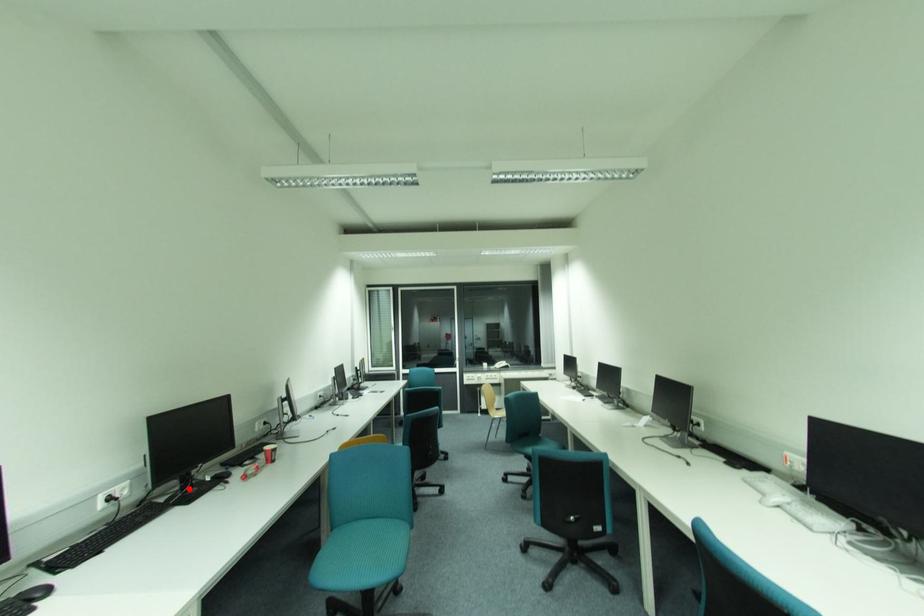
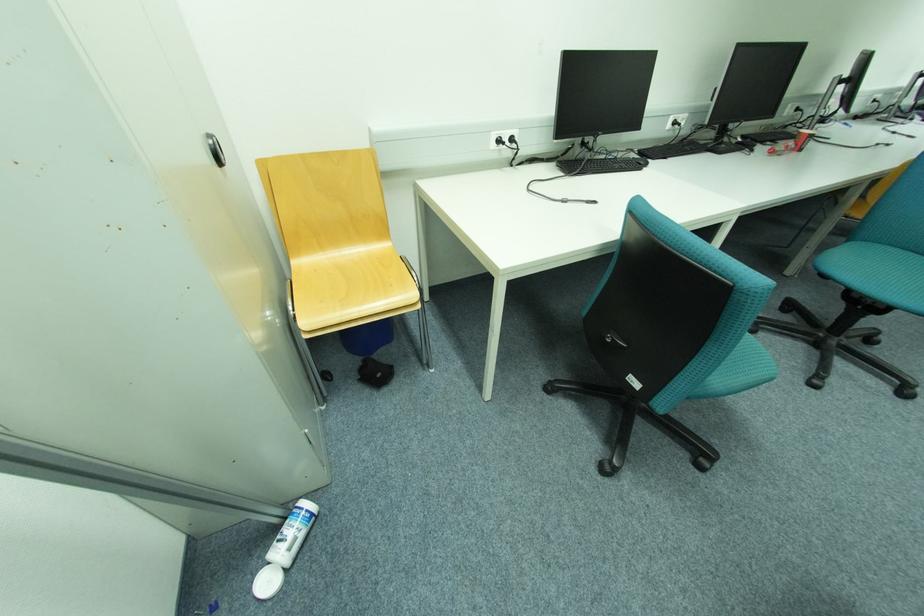
Where in the second image is the point corresponding to the highlighted location from the first image?

(723, 140)